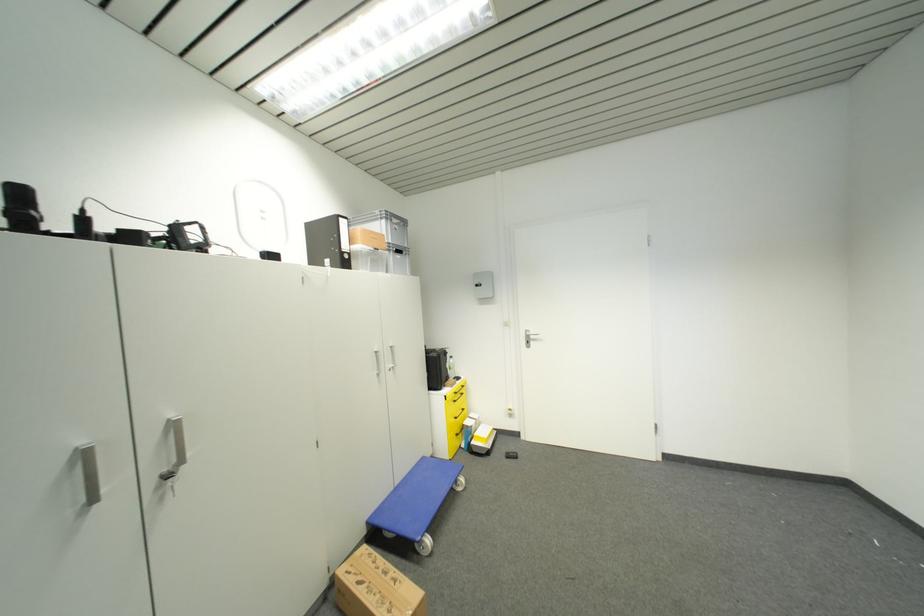
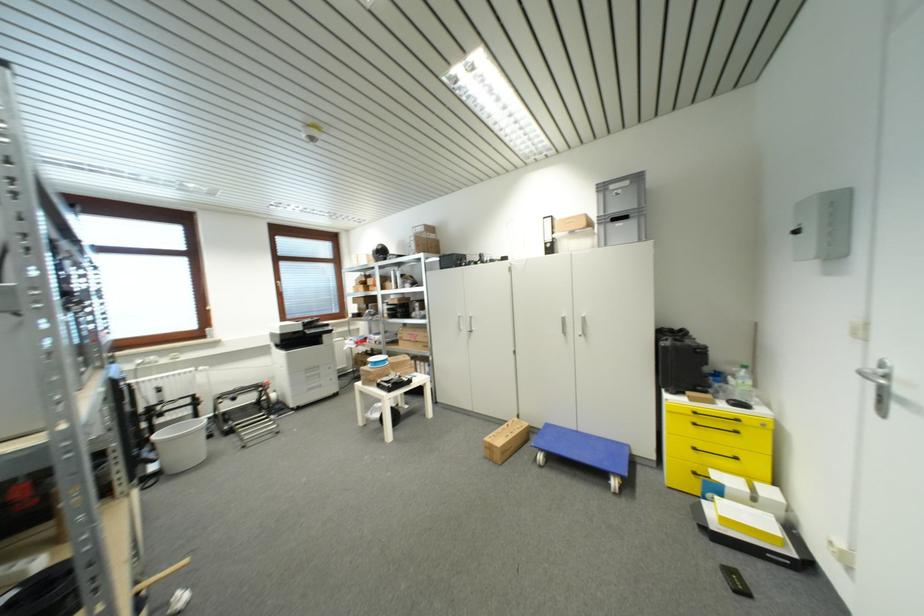
Where in the second image is the point corresponding to (539,342) from the first image?

(909, 405)